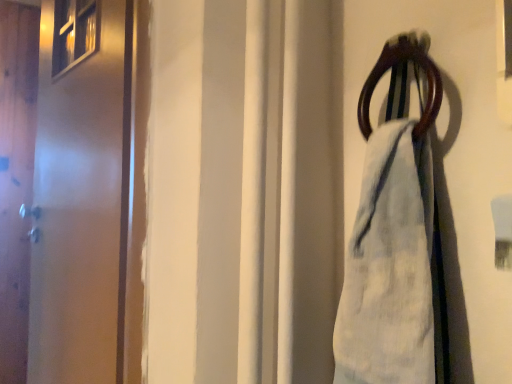
What do you see at coordinates (81, 192) in the screenshot? I see `matte wooden screen door at left` at bounding box center [81, 192].

You are a GUI agent. You are given a task and a screenshot of the screen. Output one action in this format:
    pyautogui.click(x=<x>, y=<y>)
    Task: Click on the matte wooden screen door at left
    The image size is (512, 384).
    Given the screenshot: What is the action you would take?
    pyautogui.click(x=81, y=192)

Find the location of a particular element. matte wooden screen door at left is located at coordinates (81, 192).